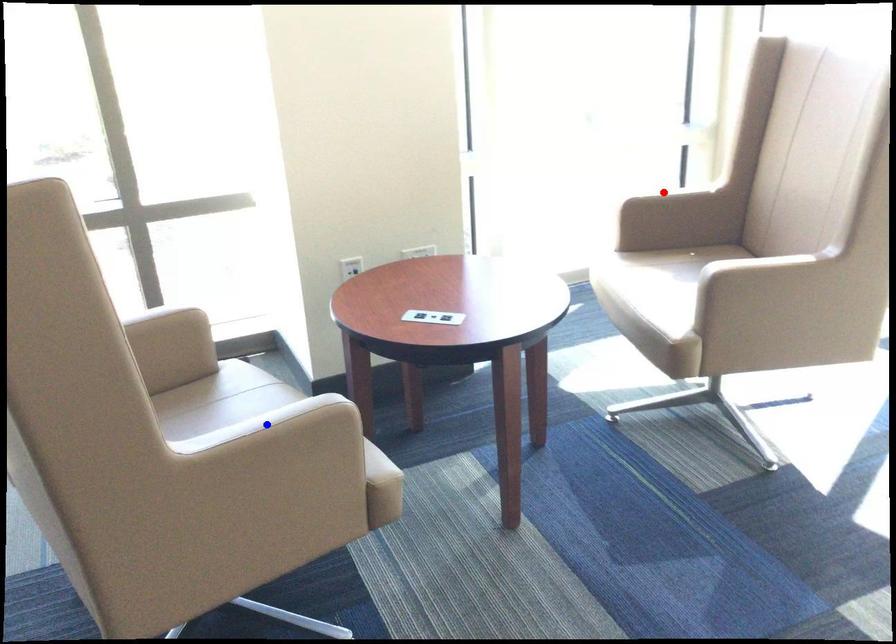
Question: Which of the two points in the image is closer to the camera?

Choices:
 (A) Blue point is closer.
 (B) Red point is closer.

Answer: (A)